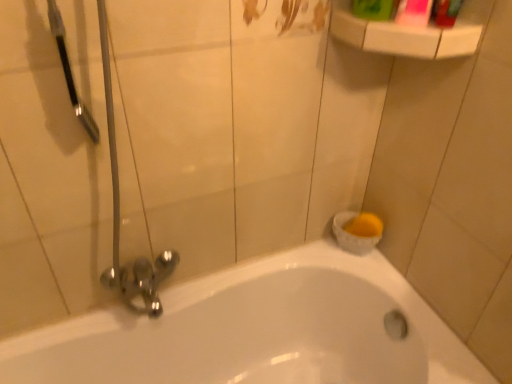
Question: Does point 357,8 appear closer or farther from the camera than point 442,19?

Choices:
 (A) closer
 (B) farther

Answer: (B)

Question: Based on their sizes in the image, would you say green plastic mouthwash at upper right, arranged as the second mouthwash when viewed from the right, is bigger or smaller than green plastic bottle at upper right?

Choices:
 (A) small
 (B) big

Answer: (B)

Question: Estimate the real-world distances between objects in this image. Which object is farther from the green plastic mouthwash at upper right, arranged as the second mouthwash when viewed from the right?

Choices:
 (A) white plastic shelf at upper right
 (B) white glossy bathtub at lower center
 (C) green plastic bottle at upper right
 (D) pink glossy mouthwash at upper right, the first mouthwash viewed from the right

Answer: (B)

Question: Estimate the real-world distances between objects in this image. Which object is closer to the white plastic shelf at upper right?

Choices:
 (A) pink glossy mouthwash at upper right, marked as the second mouthwash in a left-to-right arrangement
 (B) white glossy bathtub at lower center
 (C) green plastic bottle at upper right
 (D) green plastic mouthwash at upper right, arranged as the second mouthwash when viewed from the right

Answer: (A)